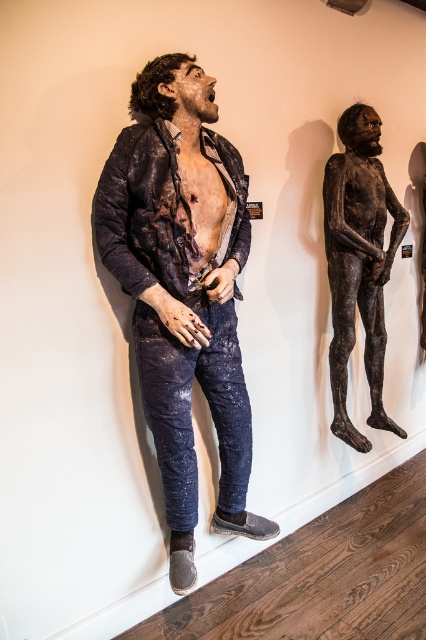
Is distressed denim jacket at center to the right of bronze statue at right from the viewer's perspective?

No, distressed denim jacket at center is not to the right of bronze statue at right.

Who is more distant from viewer, (176, 556) or (331, 365)?

Positioned behind is point (331, 365).

Between point (166, 77) and point (344, 211), which one is positioned behind?

Point (344, 211)

Locate an element on the screen. The image size is (426, 640). distressed denim jacket at center is located at coordinates 183,289.